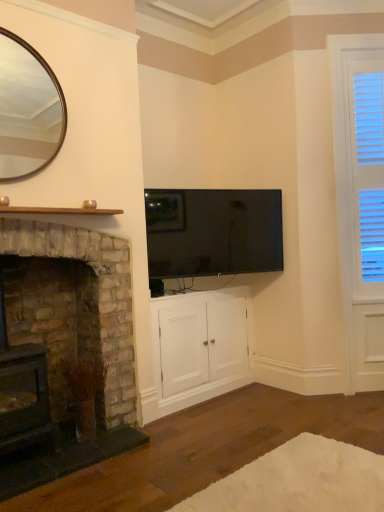
Question: Is flat-screen black tv at upper center outside of rustic stone fireplace at left, the 1th fireplace positioned from the right?

Choices:
 (A) yes
 (B) no

Answer: (A)

Question: Is flat-screen black tv at upper center looking in the opposite direction of rustic stone fireplace at left, which is counted as the 2th fireplace, starting from the left?

Choices:
 (A) yes
 (B) no

Answer: (B)

Question: Are flat-screen black tv at upper center and rustic stone fireplace at left, the 1th fireplace positioned from the right, far apart?

Choices:
 (A) no
 (B) yes

Answer: (A)

Question: Can you confirm if flat-screen black tv at upper center is shorter than rustic stone fireplace at left, the 1th fireplace positioned from the right?

Choices:
 (A) yes
 (B) no

Answer: (A)

Question: From a real-world perspective, does flat-screen black tv at upper center sit lower than rustic stone fireplace at left, the 1th fireplace positioned from the right?

Choices:
 (A) yes
 (B) no

Answer: (B)

Question: Considering the positions of white wood blinds at right and white wood cabinet at center in the image, is white wood blinds at right wider or thinner than white wood cabinet at center?

Choices:
 (A) thin
 (B) wide

Answer: (A)

Question: Is white wood blinds at right to the left or to the right of white wood cabinet at center in the image?

Choices:
 (A) right
 (B) left

Answer: (A)

Question: Is point (350, 280) positioned closer to the camera than point (175, 365)?

Choices:
 (A) closer
 (B) farther

Answer: (B)

Question: Looking at the image, does white wood blinds at right seem bigger or smaller compared to white wood cabinet at center?

Choices:
 (A) big
 (B) small

Answer: (B)

Question: Is black plastic phone at lower center wider or thinner than rustic stone fireplace at left, the first fireplace in the left-to-right sequence?

Choices:
 (A) wide
 (B) thin

Answer: (B)

Question: Is black plastic phone at lower center inside the boundaries of rustic stone fireplace at left, the first fireplace in the left-to-right sequence, or outside?

Choices:
 (A) inside
 (B) outside

Answer: (B)

Question: From the image's perspective, is black plastic phone at lower center above or below rustic stone fireplace at left, acting as the second fireplace starting from the right?

Choices:
 (A) below
 (B) above

Answer: (B)

Question: Is black plastic phone at lower center in front of or behind rustic stone fireplace at left, the first fireplace in the left-to-right sequence, in the image?

Choices:
 (A) front
 (B) behind

Answer: (B)

Question: Visually, is white wood cabinet at center positioned to the left or to the right of rustic stone fireplace at left, the first fireplace in the left-to-right sequence?

Choices:
 (A) right
 (B) left

Answer: (A)

Question: From the image's perspective, is white wood cabinet at center above or below rustic stone fireplace at left, the first fireplace in the left-to-right sequence?

Choices:
 (A) below
 (B) above

Answer: (A)